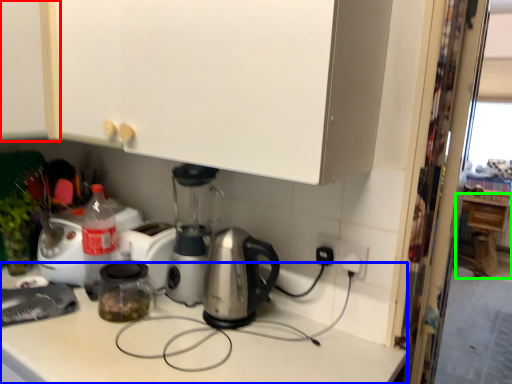
Question: Which object is the farthest from cabinetry (highlighted by a red box)? Choose among these: counter top (highlighted by a blue box) or cabinetry (highlighted by a green box).

Choices:
 (A) counter top
 (B) cabinetry

Answer: (B)